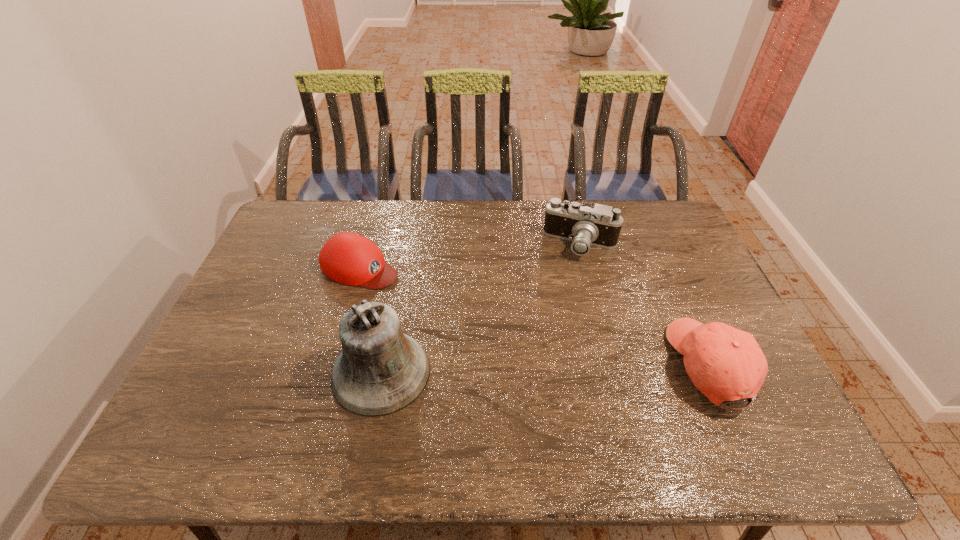
Identify the location of free space located on the front-facing side of the shortest object. The height and width of the screenshot is (540, 960). (426, 294).

Image resolution: width=960 pixels, height=540 pixels. I want to click on blank space located 0.090m at the lens of the third object from left to right, so point(558,279).

Where is `vacant space positioned at the lens of the third object from left to right`? Image resolution: width=960 pixels, height=540 pixels. vacant space positioned at the lens of the third object from left to right is located at coordinates (518, 347).

Where is `vacant position located 0.160m at the lens of the third object from left to right`? vacant position located 0.160m at the lens of the third object from left to right is located at coordinates (550, 293).

Find the location of a particular element. object that is at the far edge is located at coordinates (588, 224).

Image resolution: width=960 pixels, height=540 pixels. What are the coordinates of `bell at the near edge` in the screenshot? It's located at (381, 370).

Locate an element on the screen. The height and width of the screenshot is (540, 960). baseball cap that is at the near edge is located at coordinates (726, 364).

Where is `object present at the right edge`? The width and height of the screenshot is (960, 540). object present at the right edge is located at coordinates (726, 364).

The width and height of the screenshot is (960, 540). I want to click on object that is at the near right corner, so click(726, 364).

Identify the location of vacant position at the far edge of the desktop. (385, 209).